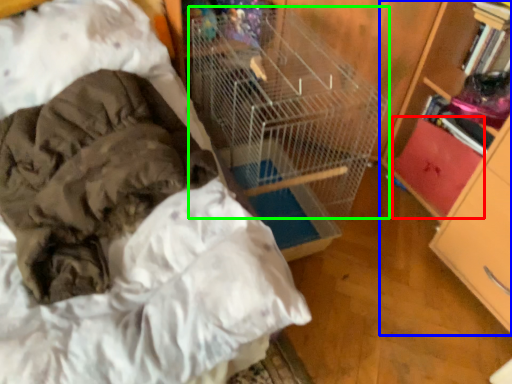
Question: Estimate the real-world distances between objects in this image. Which object is farther from drawer (highlighted by a red box), bookcase (highlighted by a blue box) or bird cage (highlighted by a green box)?

Choices:
 (A) bookcase
 (B) bird cage

Answer: (B)